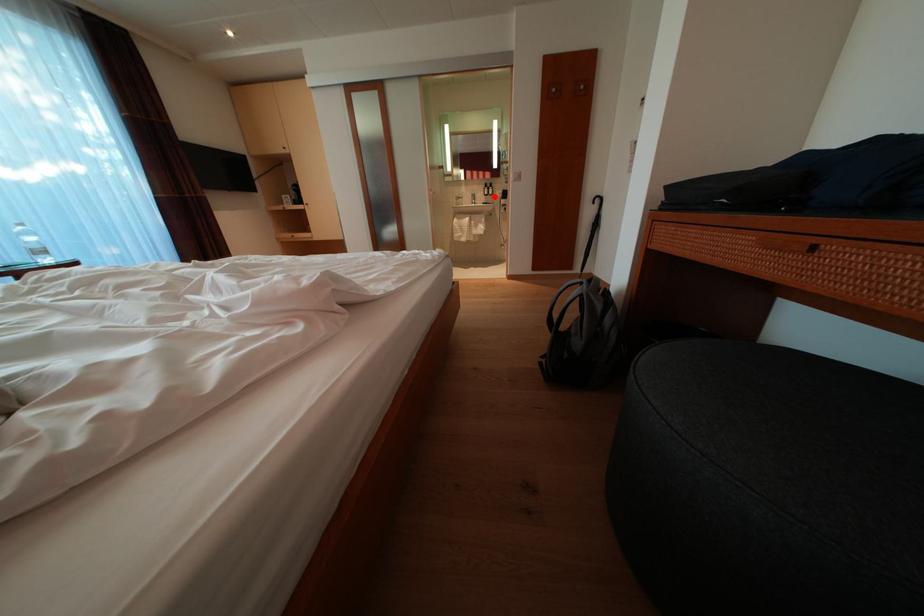
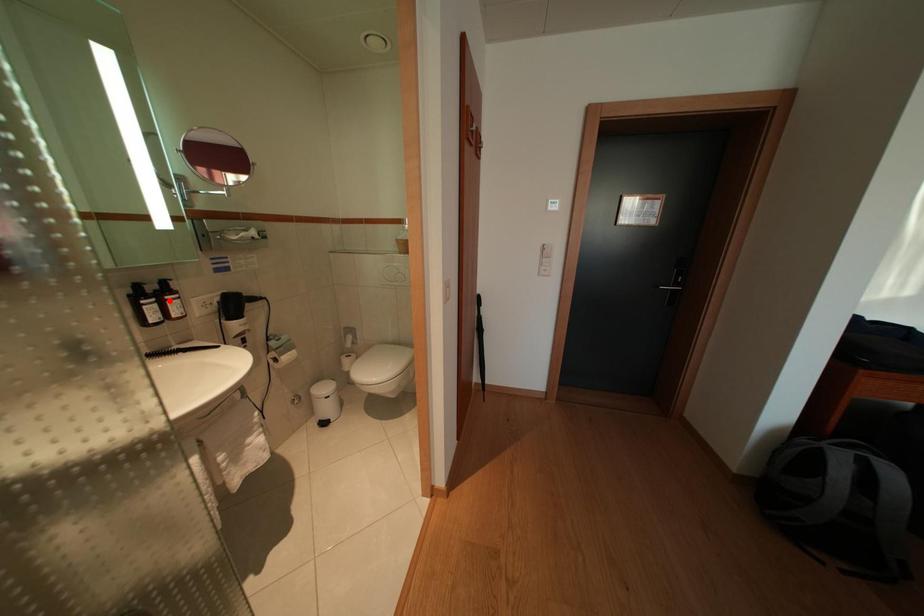
In the scene shown: I am providing you with two images of the same scene from different viewpoints. A red point is marked on the first image and another point is marked on the second image. Are the points marked in image1 and image2 representing the same 3D position?

No